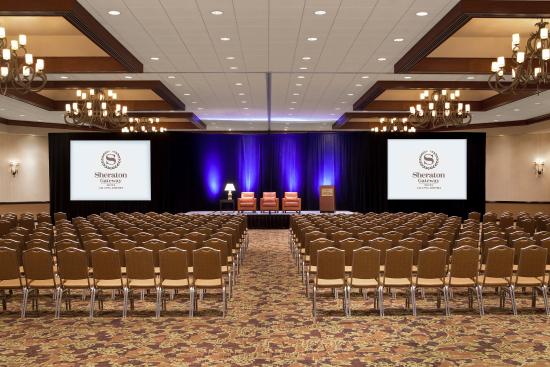
Locate an element on the screen. The height and width of the screenshot is (367, 550). light is located at coordinates (250, 176).